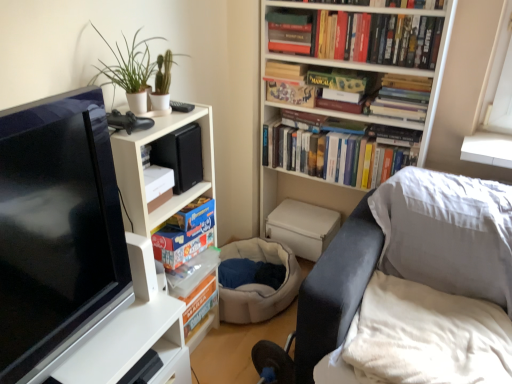
The image size is (512, 384). I want to click on free spot below matte black tv at left (from a real-world perspective), so click(x=101, y=347).